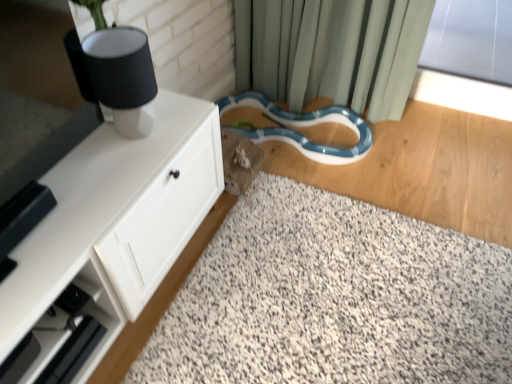
Question: Is point (108, 306) positioned closer to the camera than point (123, 41)?

Choices:
 (A) farther
 (B) closer

Answer: (A)

Question: Based on their positions, is white matte cabinet at left located to the left or right of black matte table lamp at upper left?

Choices:
 (A) right
 (B) left

Answer: (B)

Question: Which object is positioned closest to the black matte table lamp at upper left?

Choices:
 (A) blue glossy snake at lower center
 (B) white speckled carpet at center
 (C) white matte cabinet at left

Answer: (C)

Question: Estimate the real-world distances between objects in this image. Which object is closer to the blue glossy snake at lower center?

Choices:
 (A) white matte cabinet at left
 (B) black matte table lamp at upper left
 (C) white speckled carpet at center

Answer: (C)